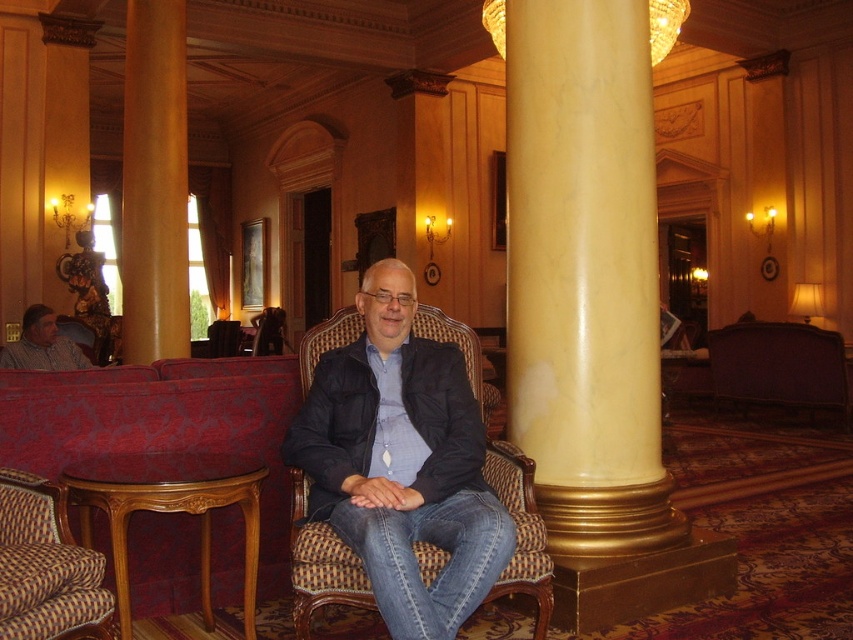
You are standing in the grand lobby and want to locate the yellow marble column at center. According to the coordinates provided, where would you find it?

The yellow marble column at center is located at the coordinates point (585, 275).

You are planning to place a rectangular table that is 1.2 meters wide between the velvet red couch at lower left and the wooden polished stool at lower left. Based on the scene description, will the table fit between them?

The velvet red couch at lower left is wider than the wooden polished stool at lower left. Since the table is 1.2 meters wide, the space between them must be at least 1.2 meters. However, the exact distance isn

You are standing at point A located at coordinates point (78, 467) and want to walk towards point B located at coordinates point (149, 448). According to the scene description, which direction should you move relative to your current position?

To move from point (78, 467) to point (149, 448), you should move backward since point (149, 448) is behind point (78, 467).